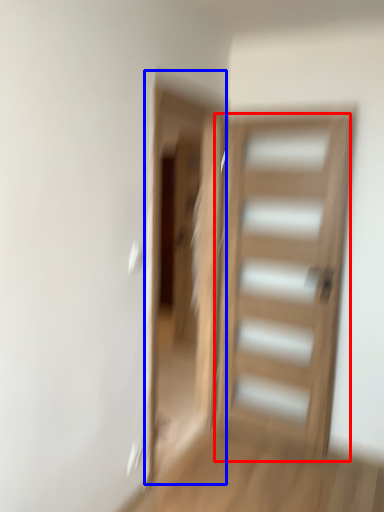
Question: Which point is further to the camera, door (highlighted by a red box) or screen door (highlighted by a blue box)?

Choices:
 (A) door
 (B) screen door

Answer: (A)